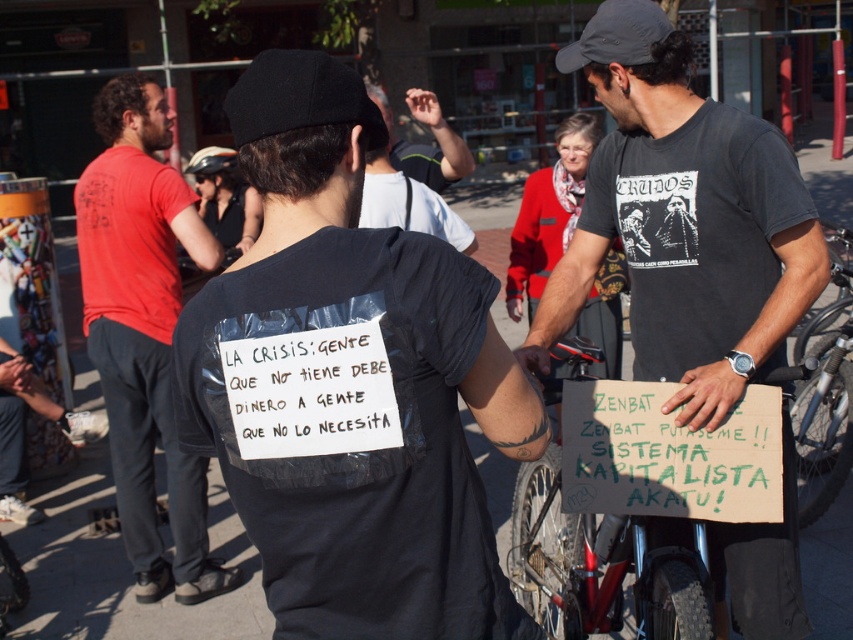
You are a photographer trying to capture a closeup of the sign held by the person in the black Tshirt. You are standing at the same position as the photographer in the image. Which of the two points, point (334, 88) or point (415, 99), is closer to your camera lens?

Point (334, 88) is closer to the camera lens than point (415, 99).

You are a photographer trying to capture a clear shot of both the black fabric baseball cap at upper center and the white paper sign at center. Based on their positions, which object will appear larger in your photo?

The black fabric baseball cap at upper center will appear larger in the photo because it is closer to the viewer than the white paper sign at center.